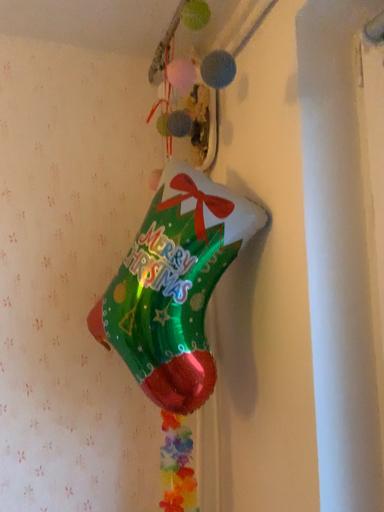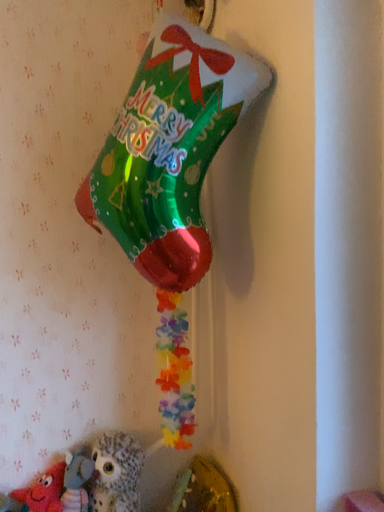
Question: How did the camera likely rotate when shooting the video?

Choices:
 (A) rotated upward
 (B) rotated downward

Answer: (B)